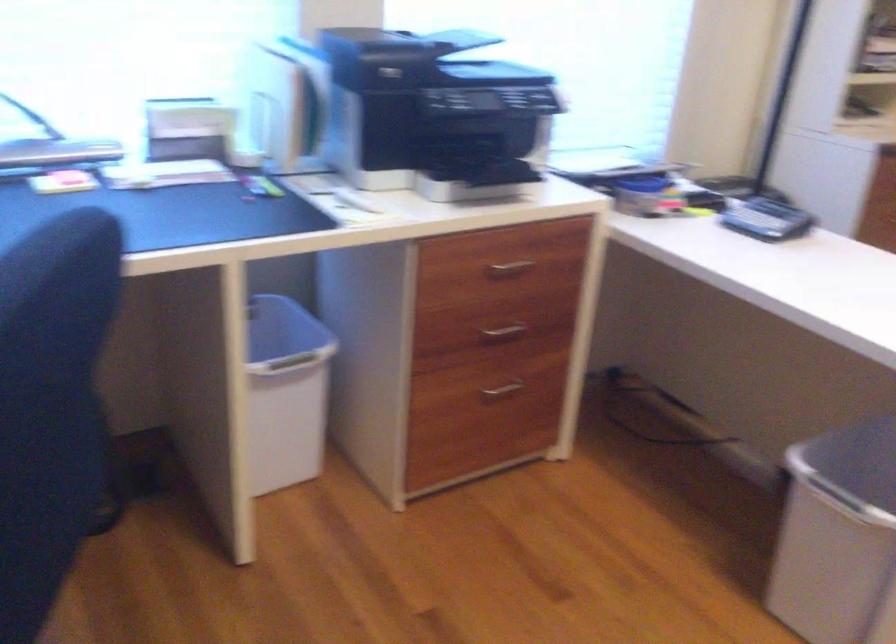
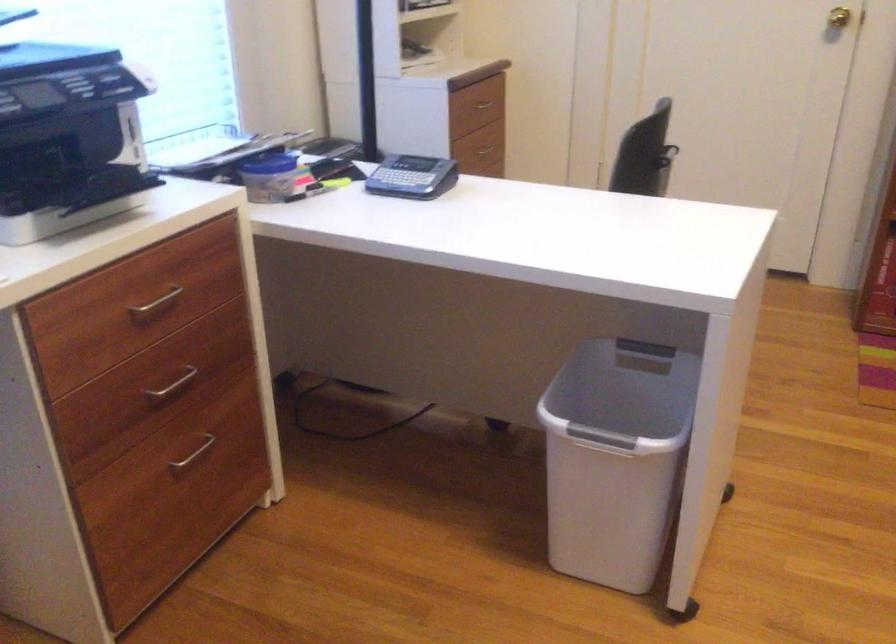
The point at [503,389] is marked in the first image. Where is the corresponding point in the second image?

(193, 453)